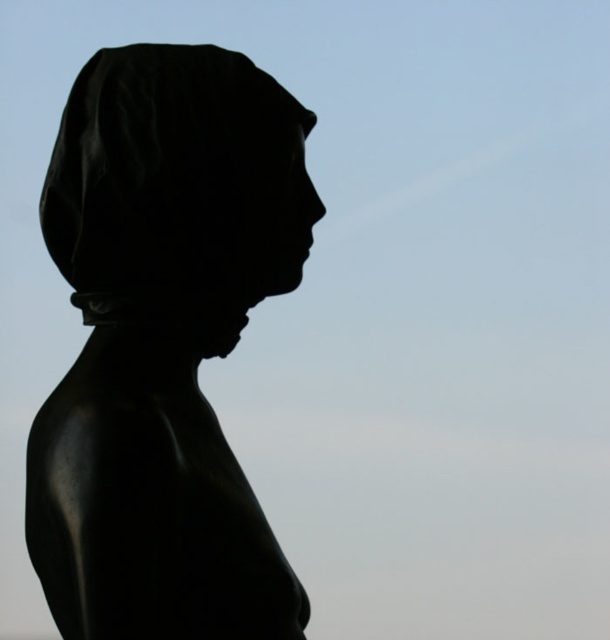
Is point (178, 227) behind point (314, 124)?

No, (178, 227) is closer to viewer.

Which of these two, black polished statue at center or black matte head at center, stands taller?

With more height is black polished statue at center.

Locate an element on the screen. The height and width of the screenshot is (640, 610). black polished statue at center is located at coordinates (163, 344).

Locate an element on the screen. This screenshot has width=610, height=640. black polished statue at center is located at coordinates (163, 344).